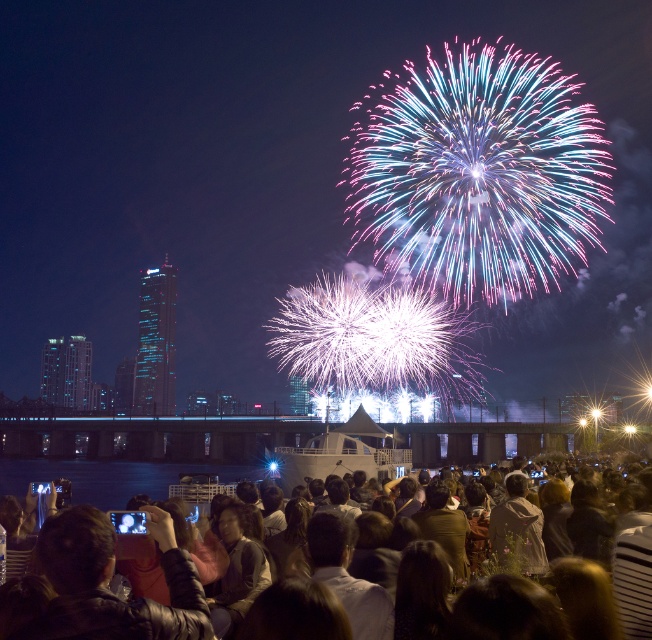
Describe the element at coordinates (110, 477) in the screenshot. Image resolution: width=652 pixels, height=640 pixels. I see `transparent water at lower center` at that location.

Between transparent water at lower center and dark brown hair at lower center, which one has more height?

Standing taller between the two is dark brown hair at lower center.

Measure the distance between point (100, 499) and camera.

They are 270.31 meters apart.

The height and width of the screenshot is (640, 652). Find the location of `transparent water at lower center`. transparent water at lower center is located at coordinates (110, 477).